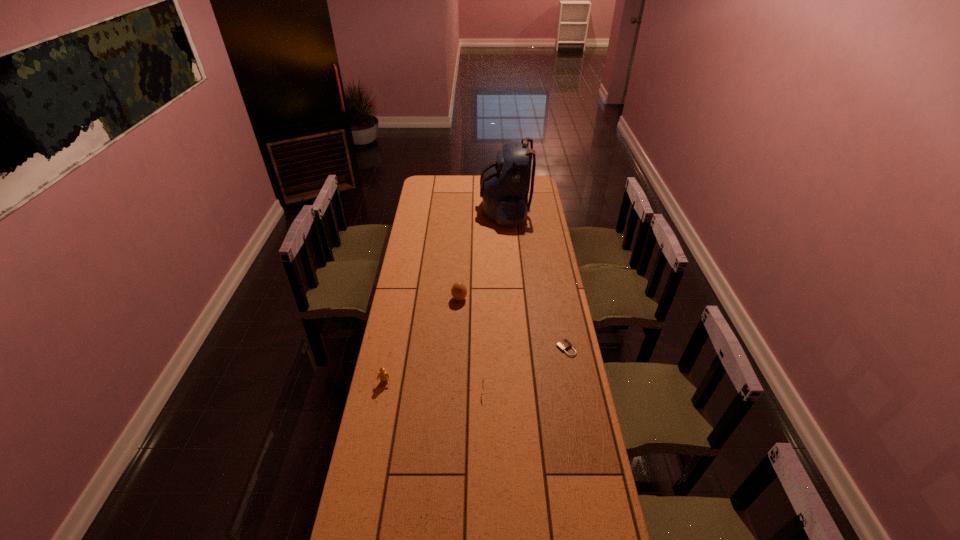
What are the coordinates of `the tallest object` in the screenshot? It's located at (504, 184).

This screenshot has width=960, height=540. Identify the location of backpack. (504, 184).

The image size is (960, 540). Find the location of `the second farthest object`. the second farthest object is located at coordinates (458, 291).

Where is `boiled egg`? Image resolution: width=960 pixels, height=540 pixels. boiled egg is located at coordinates (458, 291).

Where is `the third tallest object`? the third tallest object is located at coordinates (383, 375).

Locate an element on the screen. Lego is located at coordinates click(x=383, y=375).

Where is `the fourth tallest object`? This screenshot has height=540, width=960. the fourth tallest object is located at coordinates (483, 378).

The image size is (960, 540). In order to click on the third farthest object in this screenshot , I will do tap(564, 344).

Where is `padlock`? This screenshot has width=960, height=540. padlock is located at coordinates (564, 344).

The height and width of the screenshot is (540, 960). I want to click on free space located at the front pocket of the tallest object, so click(464, 210).